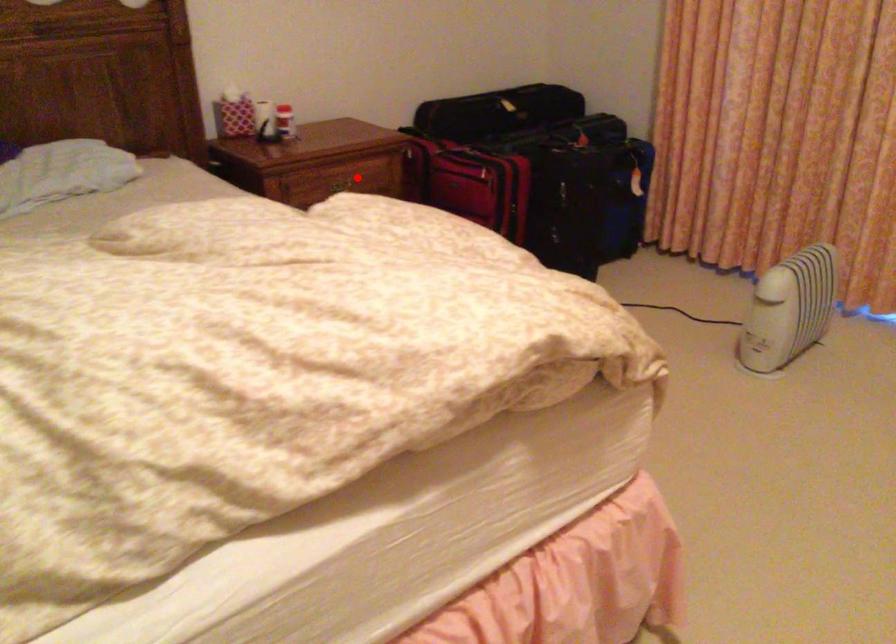
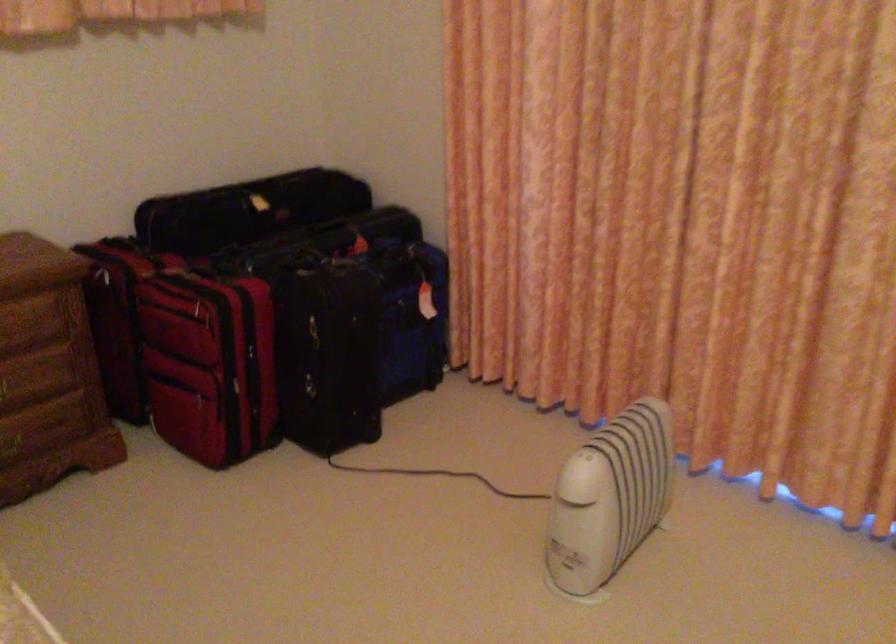
Find the pixel in the second image that matches the highlighted location in the first image.

(14, 319)